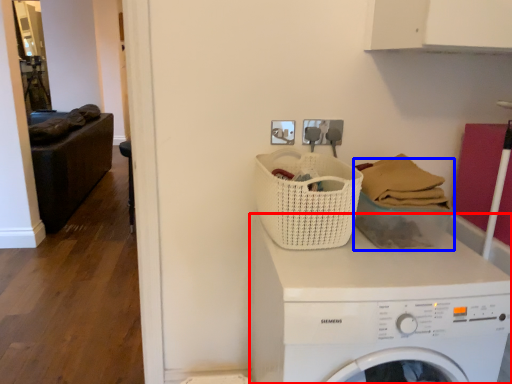
Question: Among these objects, which one is nearest to the camera, washing machine (highlighted by a red box) or basket (highlighted by a blue box)?

Choices:
 (A) washing machine
 (B) basket

Answer: (A)